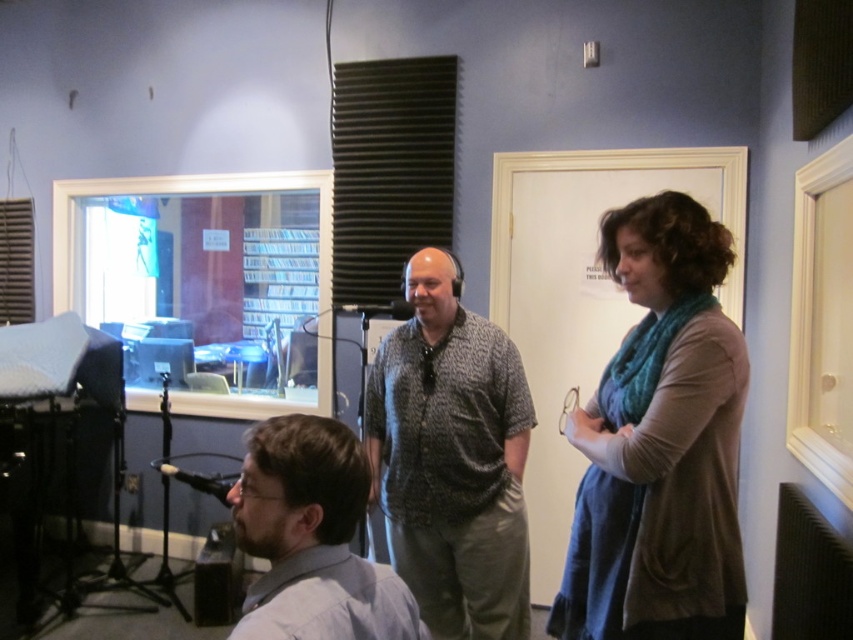
Question: Among these objects, which one is nearest to the camera?

Choices:
 (A) teal knit scarf at right
 (B) patterned fabric shirt at center

Answer: (A)

Question: Which of the following is the closest to the observer?

Choices:
 (A) (279, 476)
 (B) (637, 200)
 (C) (413, 493)

Answer: (A)

Question: Is patterned fabric shirt at center to the right of gray shirt at lower left from the viewer's perspective?

Choices:
 (A) yes
 (B) no

Answer: (A)

Question: Is patterned fabric shirt at center to the left of gray shirt at lower left from the viewer's perspective?

Choices:
 (A) yes
 (B) no

Answer: (B)

Question: Is patterned fabric shirt at center above gray shirt at lower left?

Choices:
 (A) no
 (B) yes

Answer: (A)

Question: Which point is closer to the camera?

Choices:
 (A) (340, 524)
 (B) (459, 637)

Answer: (A)